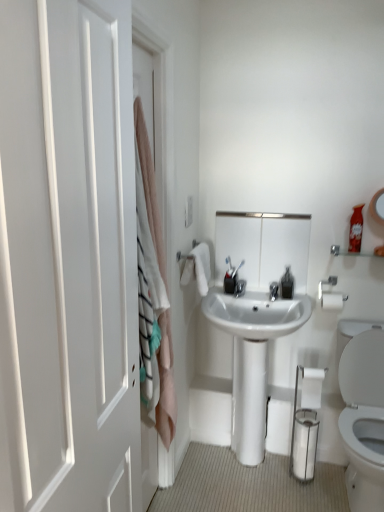
Question: Is clear plastic soap dispenser at center positioned far away from white cotton towel at upper center?

Choices:
 (A) no
 (B) yes

Answer: (A)

Question: Does clear plastic soap dispenser at center lie in front of white cotton towel at upper center?

Choices:
 (A) no
 (B) yes

Answer: (A)

Question: From a real-world perspective, is clear plastic soap dispenser at center located higher than white cotton towel at upper center?

Choices:
 (A) no
 (B) yes

Answer: (A)

Question: Does clear plastic soap dispenser at center appear on the right side of white cotton towel at upper center?

Choices:
 (A) no
 (B) yes

Answer: (B)

Question: Considering the relative sizes of clear plastic soap dispenser at center and white cotton towel at upper center in the image provided, is clear plastic soap dispenser at center bigger than white cotton towel at upper center?

Choices:
 (A) no
 (B) yes

Answer: (A)

Question: In terms of width, does white glossy toilet paper at lower right look wider or thinner when compared to pink fabric curtain at left?

Choices:
 (A) thin
 (B) wide

Answer: (A)

Question: Is white glossy toilet paper at lower right taller or shorter than pink fabric curtain at left?

Choices:
 (A) short
 (B) tall

Answer: (A)

Question: Looking at the image, does white glossy toilet paper at lower right seem bigger or smaller compared to pink fabric curtain at left?

Choices:
 (A) small
 (B) big

Answer: (A)

Question: Do you think white glossy toilet paper at lower right is within pink fabric curtain at left, or outside of it?

Choices:
 (A) inside
 (B) outside

Answer: (B)

Question: Considering the positions of white glossy sink at center and silver metallic towel bar at upper right in the image, is white glossy sink at center bigger or smaller than silver metallic towel bar at upper right?

Choices:
 (A) big
 (B) small

Answer: (A)

Question: From a real-world perspective, is white glossy sink at center positioned above or below silver metallic towel bar at upper right?

Choices:
 (A) above
 (B) below

Answer: (B)

Question: Is point (238, 315) positioned closer to the camera than point (324, 306)?

Choices:
 (A) farther
 (B) closer

Answer: (B)

Question: From the image's perspective, is white glossy sink at center positioned above or below silver metallic towel bar at upper right?

Choices:
 (A) above
 (B) below

Answer: (B)

Question: Choose the correct answer: Is white glossy sink at center inside white matte door at left or outside it?

Choices:
 (A) inside
 (B) outside

Answer: (B)

Question: Based on their positions, is white glossy sink at center located to the left or right of white matte door at left?

Choices:
 (A) right
 (B) left

Answer: (A)